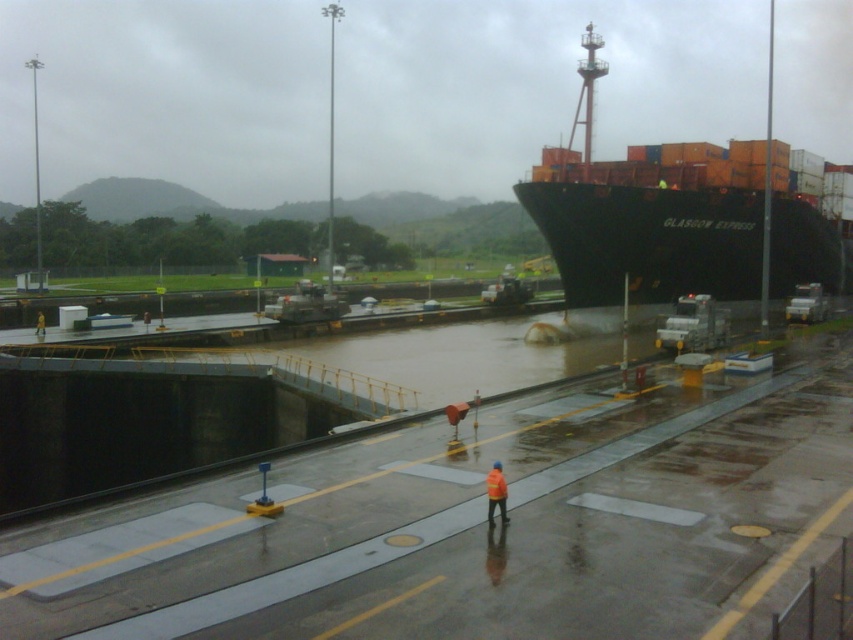
You are a crane operator tasked with loading containers onto the black matte container ship at upper right and the orange reflective jacket at center. Since you need to ensure the crane can reach both areas, which object requires the crane to be raised higher?

The black matte container ship at upper right requires the crane to be raised higher because it has a greater height compared to the orange reflective jacket at center.

You are standing at the lock system and want to take a photo of the GLASGOW EXPRESS ship. You notice two points marked on your map at coordinates point (776, 273) and point (498, 470). Which point is closer to you, the photographer, so you can position yourself there for the best shot?

Point (498, 470) is closer to you, the photographer, because it is less further to the camera than point (776, 273) according to the description.

You are a safety inspector on the dock and need to ensure that the black matte container ship at upper right and the orange reflective jacket at center are visible from the control tower. Given that the control tower has a clear view of the entire dock area, which object would appear wider in the surveillance footage?

The black matte container ship at upper right would appear wider in the surveillance footage because its width is larger than that of the orange reflective jacket at center.